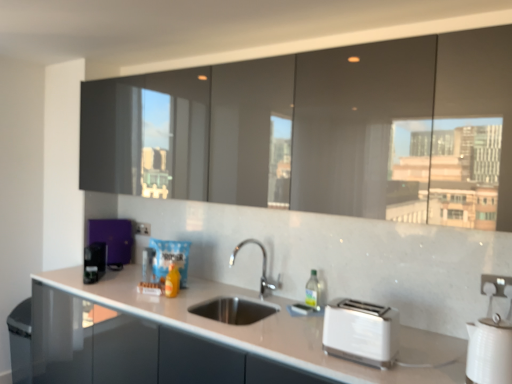
Image resolution: width=512 pixels, height=384 pixels. Find the location of `free space in front of metallic silver toaster at center, placed as the 2th appliance when sorted from right to left`. free space in front of metallic silver toaster at center, placed as the 2th appliance when sorted from right to left is located at coordinates (134, 290).